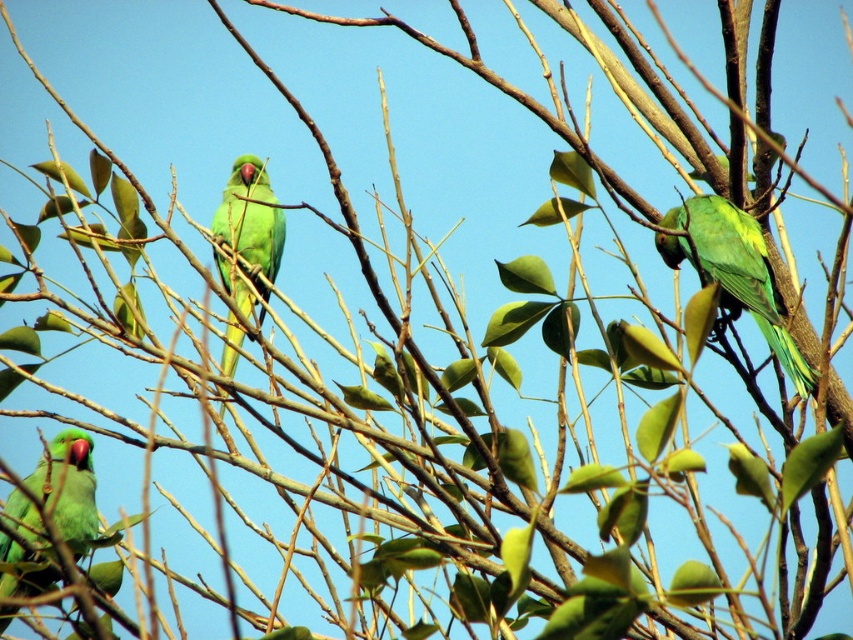
Question: Can you confirm if green matte parrot at upper right is positioned to the right of matte green parrot at lower left?

Choices:
 (A) no
 (B) yes

Answer: (B)

Question: Which of the following is the farthest from the observer?

Choices:
 (A) green matte parrot at center
 (B) green matte parrot at upper right
 (C) matte green parrot at lower left

Answer: (A)

Question: Can you confirm if green matte parrot at upper right is bigger than green matte parrot at center?

Choices:
 (A) no
 (B) yes

Answer: (A)

Question: Which point is closer to the camera?

Choices:
 (A) green matte parrot at upper right
 (B) matte green parrot at lower left

Answer: (B)

Question: Can you confirm if green matte parrot at upper right is positioned to the left of green matte parrot at center?

Choices:
 (A) yes
 (B) no

Answer: (B)

Question: Which is nearer to the matte green parrot at lower left?

Choices:
 (A) green matte parrot at center
 (B) green matte parrot at upper right

Answer: (A)